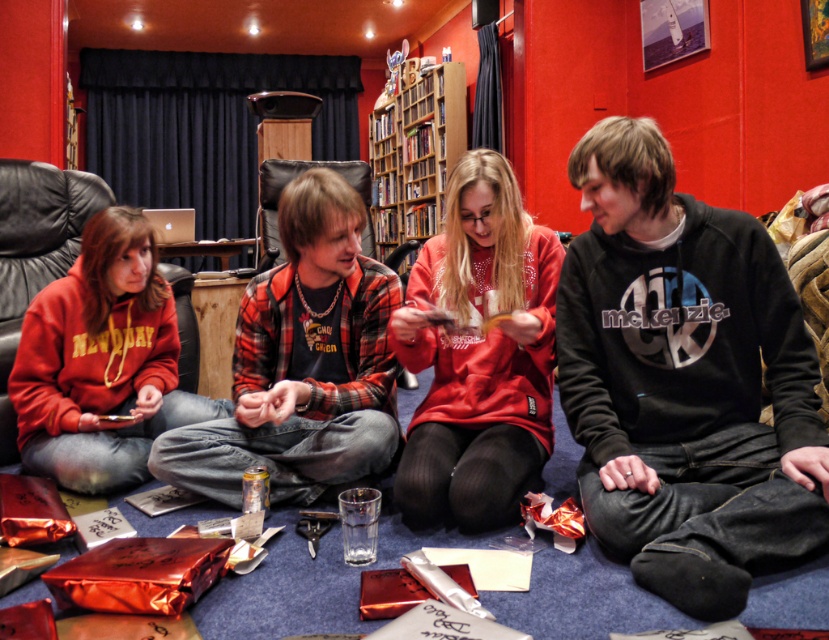
Does point (715, 324) lie behind point (424, 440)?

That is False.

Can you confirm if black cotton hoodie at center is shorter than matte red hoodie at center?

No, black cotton hoodie at center is not shorter than matte red hoodie at center.

Is point (650, 141) farther from camera compared to point (464, 275)?

No, (650, 141) is closer to viewer.

Identify the location of black cotton hoodie at center. (686, 381).

Does flannel shirt at center have a greater height compared to black leather armchair at left?

Incorrect, flannel shirt at center's height is not larger of black leather armchair at left's.

The image size is (829, 640). Describe the element at coordinates (303, 362) in the screenshot. I see `flannel shirt at center` at that location.

Who is more distant from viewer, (280, 349) or (56, 272)?

The point (56, 272) is behind.

The height and width of the screenshot is (640, 829). What are the coordinates of `flannel shirt at center` in the screenshot? It's located at (303, 362).

Is matte red hoodie at center shorter than black leather armchair at left?

Yes.

Is point (511, 369) positioned in front of point (10, 445)?

Yes, it is in front of point (10, 445).

Locate an element on the screen. The image size is (829, 640). matte red hoodie at center is located at coordinates (478, 355).